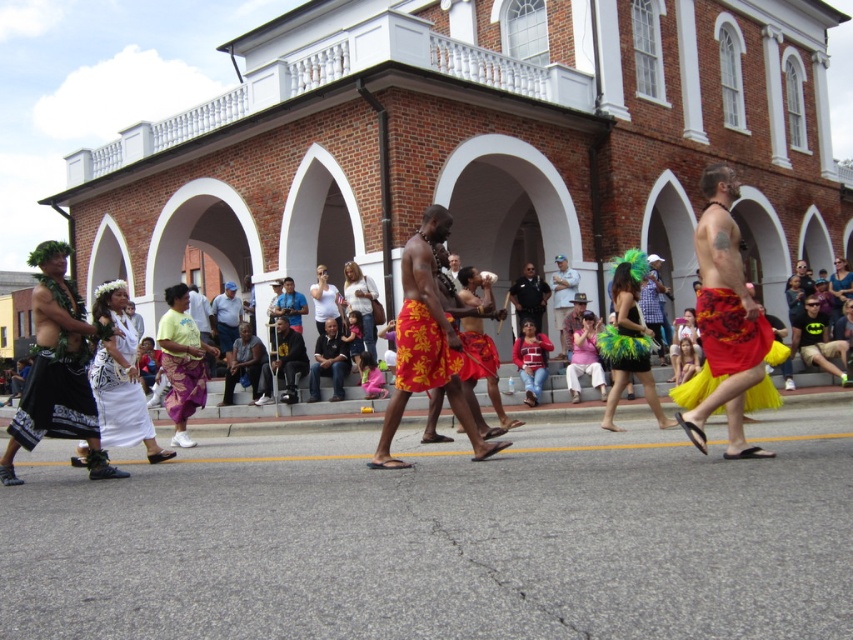
Question: Among these objects, which one is nearest to the camera?

Choices:
 (A) white satin dress at center
 (B) light blue fabric shirt at center
 (C) red floral skirt at center

Answer: (C)

Question: Can you confirm if red fabric skirt at center is smaller than floral print fabric shorts at center?

Choices:
 (A) yes
 (B) no

Answer: (A)

Question: Does multicolored fabric at center have a greater width compared to floral print fabric shorts at center?

Choices:
 (A) no
 (B) yes

Answer: (B)

Question: Does multicolored fabric at center appear under green feathered skirt at center?

Choices:
 (A) no
 (B) yes

Answer: (B)

Question: Which of these objects is positioned closest to the blue fabric camera at center?

Choices:
 (A) light blue denim shirt at center
 (B) multicolored fabric at center

Answer: (B)

Question: Estimate the real-world distances between objects in this image. Which object is farther from the matte black uniform at center?

Choices:
 (A) green feathered skirt at center
 (B) light blue denim shirt at center
 (C) white satin dress at center
 (D) black leather jacket at center

Answer: (C)